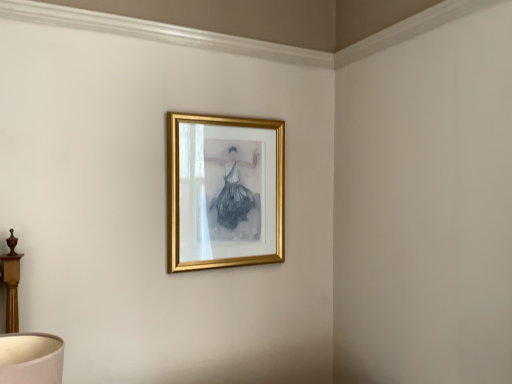
Describe the element at coordinates (224, 191) in the screenshot. The height and width of the screenshot is (384, 512). I see `gold metallic picture frame at upper center` at that location.

This screenshot has height=384, width=512. Identify the location of gold metallic picture frame at upper center. (224, 191).

The height and width of the screenshot is (384, 512). Find the location of `gold metallic picture frame at upper center`. gold metallic picture frame at upper center is located at coordinates (224, 191).